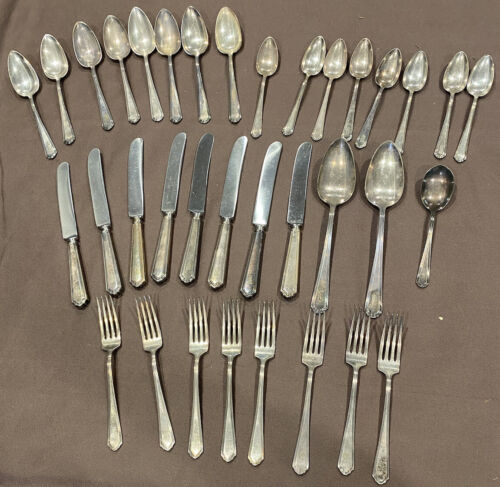
Locate an element on the screen. This screenshot has width=500, height=487. knives is located at coordinates (69, 229), (101, 216), (133, 206), (169, 204), (197, 204), (227, 209), (258, 215), (296, 215).